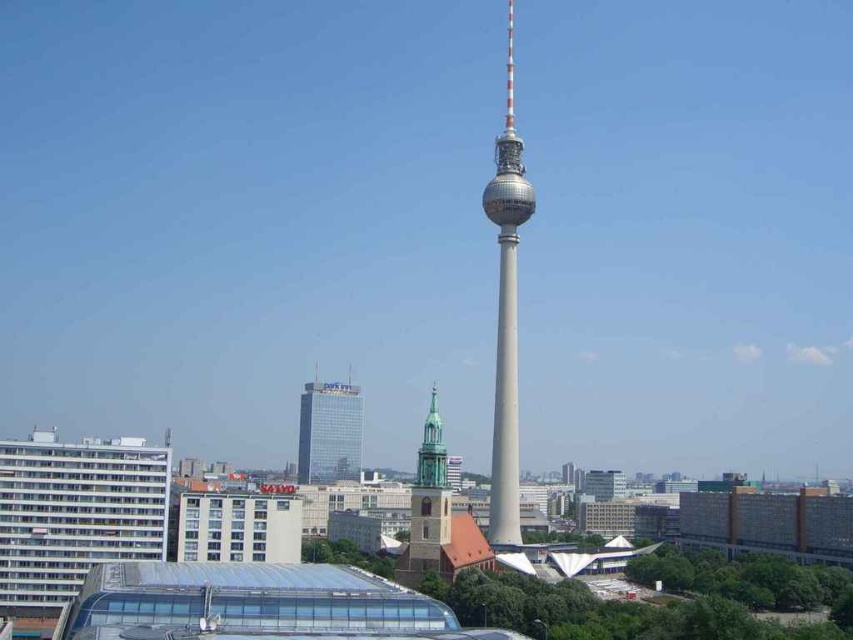
Consider the image. You are standing in the city and looking at the television tower. There are two points marked in the scene, one at coordinates point (502, 193) and the other at point (421, 564). Which point is closer to you?

Point (502, 193) is closer to you because it is further to the viewer than point (421, 564).

You are standing in the city and want to take a photo of the smooth gray tower at center. If your camera can focus up to 200 meters, will it be able to capture the tower clearly?

The distance between the smooth gray tower at center and the viewer is 232.17 meters, which exceeds the camera focus limit of 200 meters. Therefore, the camera may not capture the tower clearly.

You are a drone operator tasked with capturing aerial footage of the city. Your drone has a maximum flight range of 100 meters from its starting position. You need to fly the drone from the glassy metallic skyscraper at center to the brown stone church steeple at center. Will the drone be able to complete this flight without exceeding its range limit?

The distance between the glassy metallic skyscraper at center and the brown stone church steeple at center is 107.16 meters. Since the drone has a maximum range of 100 meters, it will not be able to complete the flight without exceeding its range limit.